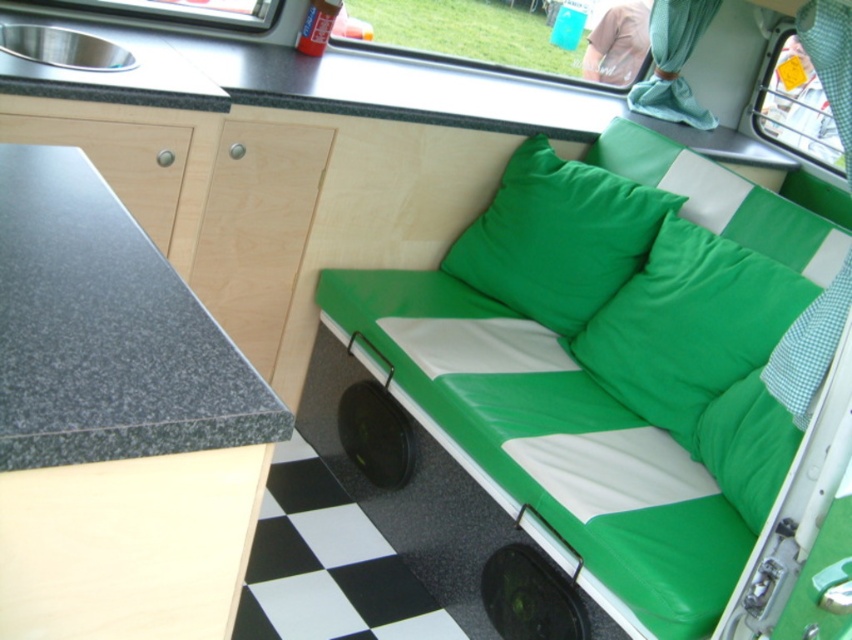
Question: Is granite countertop at left bigger than green fabric pillow at center?

Choices:
 (A) yes
 (B) no

Answer: (B)

Question: Which of these objects is positioned closest to the green fabric pillow at upper right?

Choices:
 (A) green fabric pillow at center
 (B) granite countertop at left

Answer: (A)

Question: Which of these objects is positioned farthest from the green fabric pillow at upper right?

Choices:
 (A) granite countertop at left
 (B) green fabric pillow at center

Answer: (A)

Question: Does green fabric pillow at center have a greater width compared to green fabric pillow at upper right?

Choices:
 (A) yes
 (B) no

Answer: (B)

Question: Is granite countertop at left to the left of green fabric pillow at upper right from the viewer's perspective?

Choices:
 (A) no
 (B) yes

Answer: (B)

Question: Among these objects, which one is farthest from the camera?

Choices:
 (A) green fabric pillow at upper right
 (B) granite countertop at left

Answer: (A)